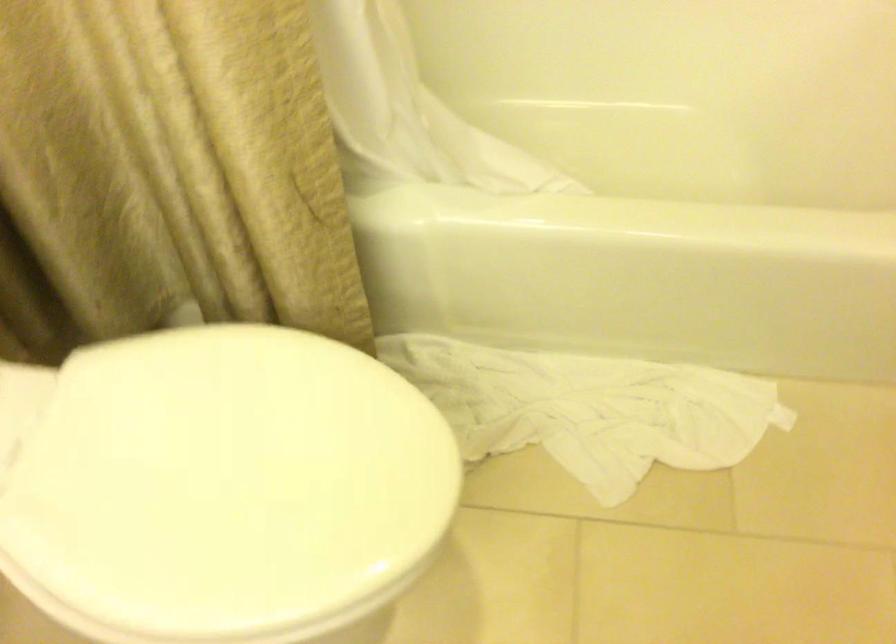
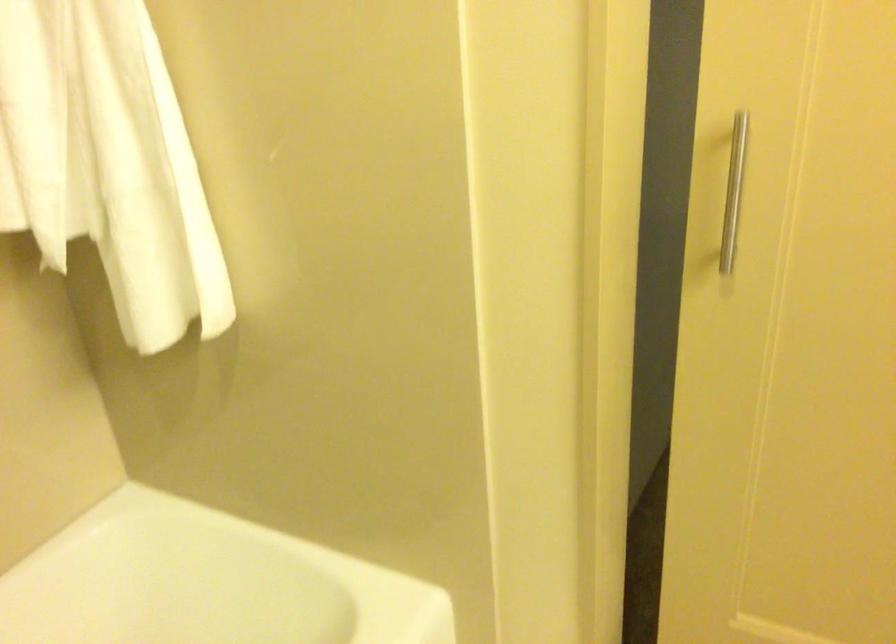
Question: How did the camera likely rotate?

Choices:
 (A) Left
 (B) Right
 (C) Up
 (D) Down

Answer: (B)